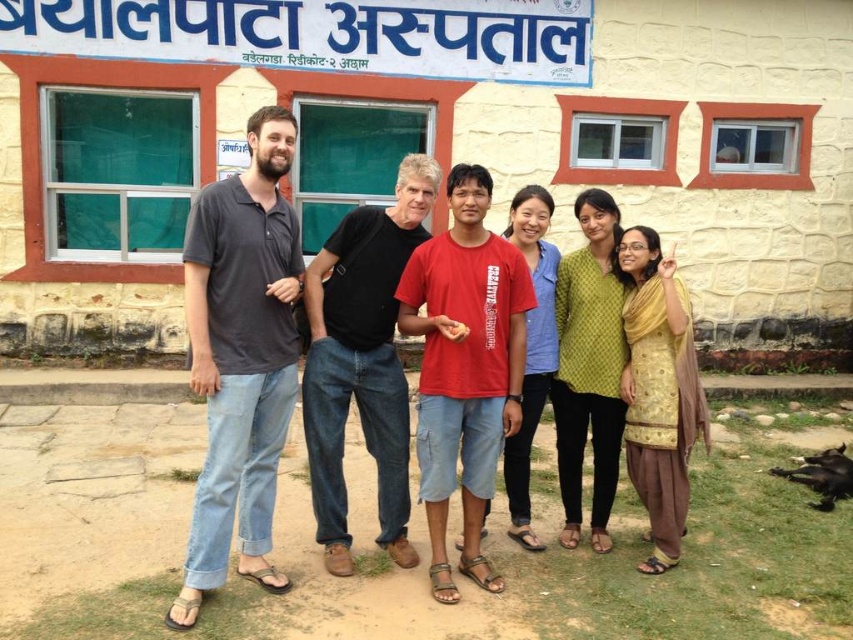
You are a photographer trying to capture a group photo of the matte gray shirt at center and the black cotton shirt at center. Since you want to ensure both subjects are clearly visible, which subject requires more space in the frame due to their clothing size?

The matte gray shirt at center requires more space in the frame because its width surpasses that of the black cotton shirt at center.

You are standing in front of the building with teal curtains and red window frames. There is a point marked at coordinates [294,369]. What object is located at that point?

The point at coordinates [294,369] marks the matte gray shirt at center.